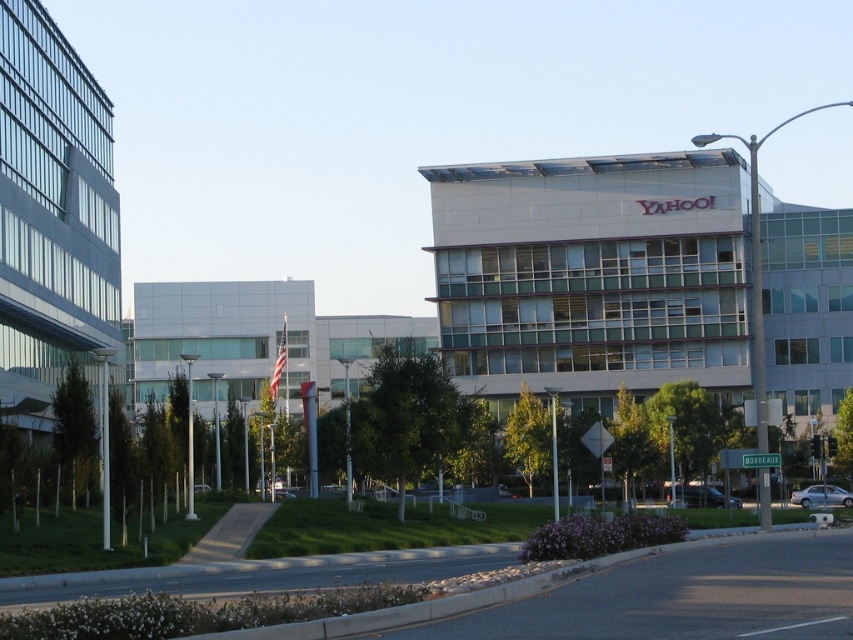
You are a delivery driver who needs to park your vehicle in the parking lot behind the two buildings. You have to choose between parking next to the dark gray metallic van at center or the silver metallic sedan at lower right. Which vehicle should you choose if you want to park next to the larger vehicle?

The dark gray metallic van at center is bigger than the silver metallic sedan at lower right, so you should park next to the dark gray metallic van at center.

You are a delivery person who needs to park your vehicle in a parking spot that has a height restriction of 6 feet. You have two vehicles available, the dark gray metallic van at center and the silver metallic sedan at lower right. Which vehicle should you choose to park without violating the height restriction?

A: The silver metallic sedan at lower right is shorter in height compared to the dark gray metallic van at center. Therefore, you should choose the silver metallic sedan at lower right to park without violating the height restriction.

You are a delivery driver who needs to park your vehicle in the parking lot between the two buildings. You have a dark gray metallic van at center and a silver metallic sedan at lower right. Which vehicle should you move to park closer to the building with the red letters?

The dark gray metallic van at center is to the left of the silver metallic sedan at lower right. Since the building with the red letters is on the right, moving the dark gray metallic van at center would position it closer to that building.